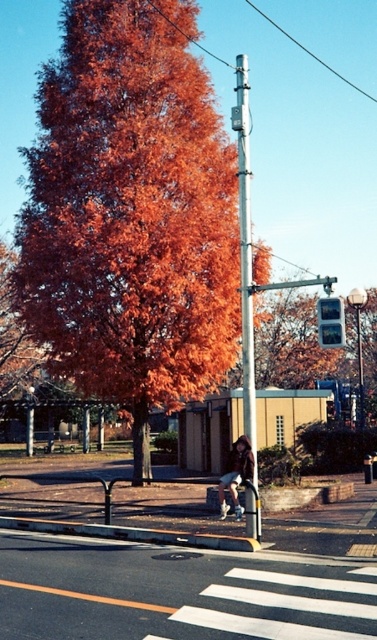
You are a city planner analyzing the space at this intersection. You need to determine if the orange leafy tree at center can be moved closer to the silver metallic pole at center without overcrowding the area. Based on their current spatial relationship, what would you advise?

The orange leafy tree at center currently occupies less space than the silver metallic pole at center. Moving the tree closer to the pole may not overcrowd the area since the tree takes up less space, but ensure there is enough room for both objects to coexist comfortably.

You are standing at the center of the image and want to find the silver metallic pole at center. According to the coordinates given, in which direction should you look to find it?

The silver metallic pole at center is located at coordinates point (245, 252). Since you are at the center of the image, you should look slightly to the left and down to find it.